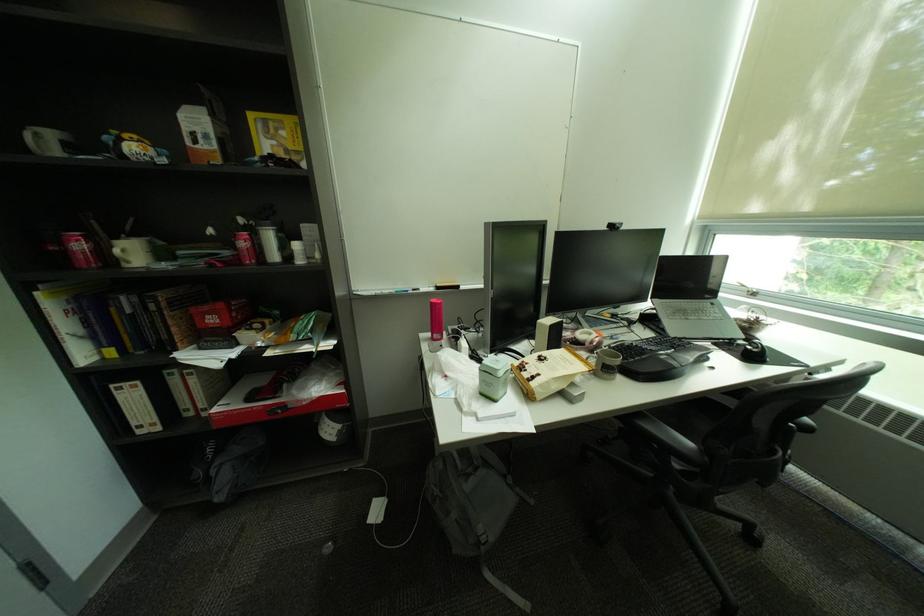
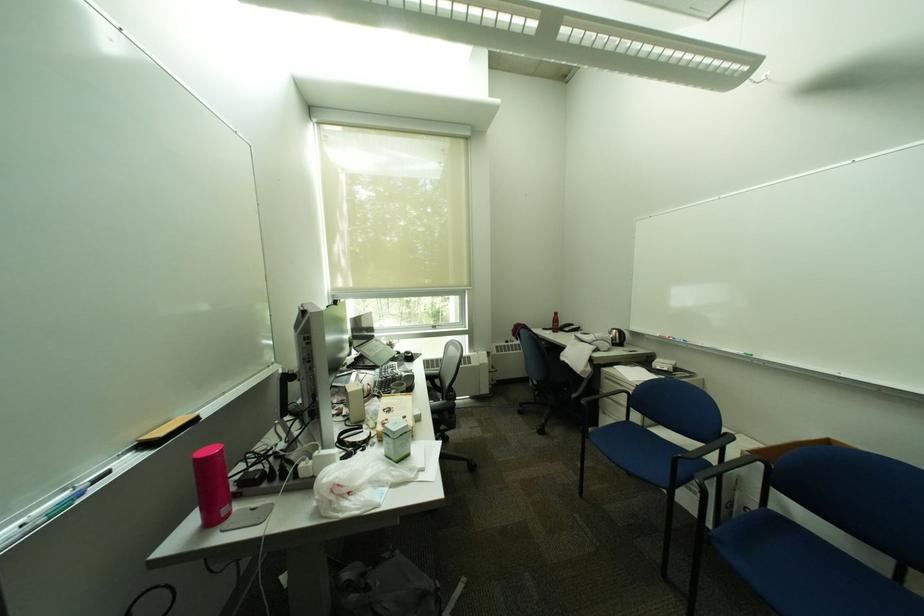
Locate, in the second image, the point that corresponds to [538,365] in the first image.

(397, 421)